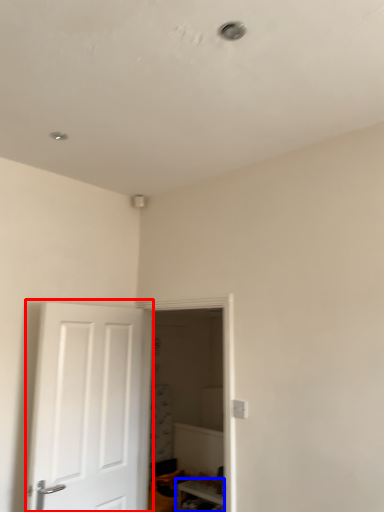
Question: Among these objects, which one is farthest to the camera, door (highlighted by a red box) or furniture (highlighted by a blue box)?

Choices:
 (A) door
 (B) furniture

Answer: (B)